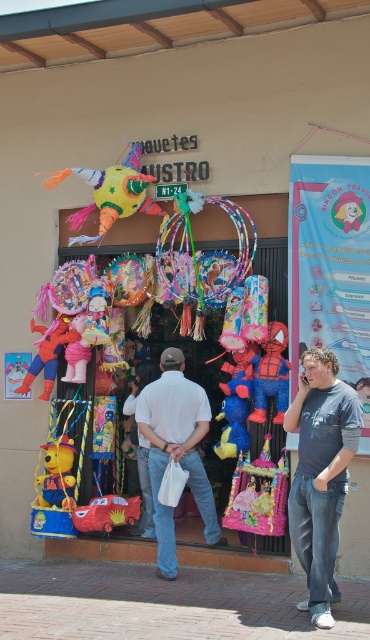
Question: Is white matte shirt at center behind matte red spiderman at center?

Choices:
 (A) yes
 (B) no

Answer: (B)

Question: Which of these objects is positioned closest to the matte red car at center?

Choices:
 (A) white matte shirt at center
 (B) velvet plush spiderman at center
 (C) denim jeans at lower right
 (D) multicolored paper piñata at center

Answer: (A)

Question: Which is nearer to the yellow fabric teddy bear at center?

Choices:
 (A) white matte shirt at center
 (B) multicolored paper piñata at center
 (C) denim jeans at lower right

Answer: (A)

Question: Which of the following is the closest to the observer?

Choices:
 (A) (261, 358)
 (B) (167, 394)
 (C) (39, 328)
 (D) (317, 465)

Answer: (D)

Question: Can you confirm if matte red spiderman at center is smaller than matte red car at center?

Choices:
 (A) yes
 (B) no

Answer: (B)

Question: Is multicolored paper piñata at center to the left of matte red spiderman at center from the viewer's perspective?

Choices:
 (A) no
 (B) yes

Answer: (A)